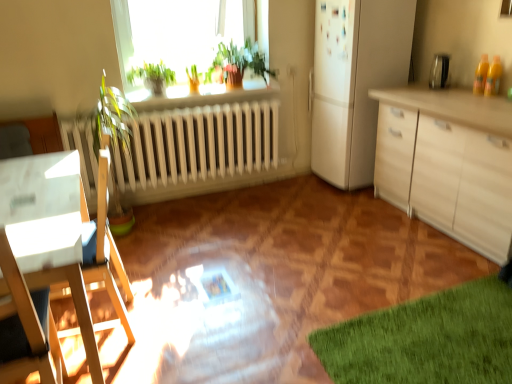
Question: From a real-world perspective, is green matte plant at upper center, which is the second plant in right-to-left order, under white matte refrigerator at upper right?

Choices:
 (A) no
 (B) yes

Answer: (B)

Question: Could you tell me if green matte plant at upper center, the first plant when ordered from left to right, is facing white matte refrigerator at upper right?

Choices:
 (A) no
 (B) yes

Answer: (A)

Question: Would you say white matte refrigerator at upper right is part of green matte plant at upper center, which is the second plant in right-to-left order,'s contents?

Choices:
 (A) yes
 (B) no

Answer: (B)

Question: Is green matte plant at upper center, which is the second plant in right-to-left order, further to camera compared to white matte refrigerator at upper right?

Choices:
 (A) yes
 (B) no

Answer: (A)

Question: From a real-world perspective, is green matte plant at upper center, which is the second plant in right-to-left order, physically above white matte refrigerator at upper right?

Choices:
 (A) no
 (B) yes

Answer: (A)

Question: Is green leafy plant at upper center, which is the first plant from right to left, in front of or behind green matte plant at upper center, the first plant when ordered from left to right, in the image?

Choices:
 (A) front
 (B) behind

Answer: (B)

Question: From the image's perspective, is green leafy plant at upper center, which is the first plant from right to left, located above or below green matte plant at upper center, the first plant when ordered from left to right?

Choices:
 (A) below
 (B) above

Answer: (B)

Question: Based on their sizes in the image, would you say green leafy plant at upper center, which is the first plant from right to left, is bigger or smaller than green matte plant at upper center, which is the second plant in right-to-left order?

Choices:
 (A) big
 (B) small

Answer: (B)

Question: Is point (192, 72) closer or farther from the camera than point (159, 87)?

Choices:
 (A) farther
 (B) closer

Answer: (A)

Question: Is white matte refrigerator at upper right taller or shorter than green leafy plant at upper center?

Choices:
 (A) tall
 (B) short

Answer: (A)

Question: Choose the correct answer: Is white matte refrigerator at upper right inside green leafy plant at upper center or outside it?

Choices:
 (A) inside
 (B) outside

Answer: (B)

Question: From a real-world perspective, relative to green leafy plant at upper center, is white matte refrigerator at upper right vertically above or below?

Choices:
 (A) above
 (B) below

Answer: (A)

Question: Does point (346, 51) appear closer or farther from the camera than point (256, 74)?

Choices:
 (A) closer
 (B) farther

Answer: (A)

Question: Based on their positions, is green leafy plant at upper center, which is the first plant from right to left, located to the left or right of white wood desk at left?

Choices:
 (A) left
 (B) right

Answer: (B)

Question: In terms of width, does green leafy plant at upper center, which is the first plant from right to left, look wider or thinner when compared to white wood desk at left?

Choices:
 (A) thin
 (B) wide

Answer: (A)